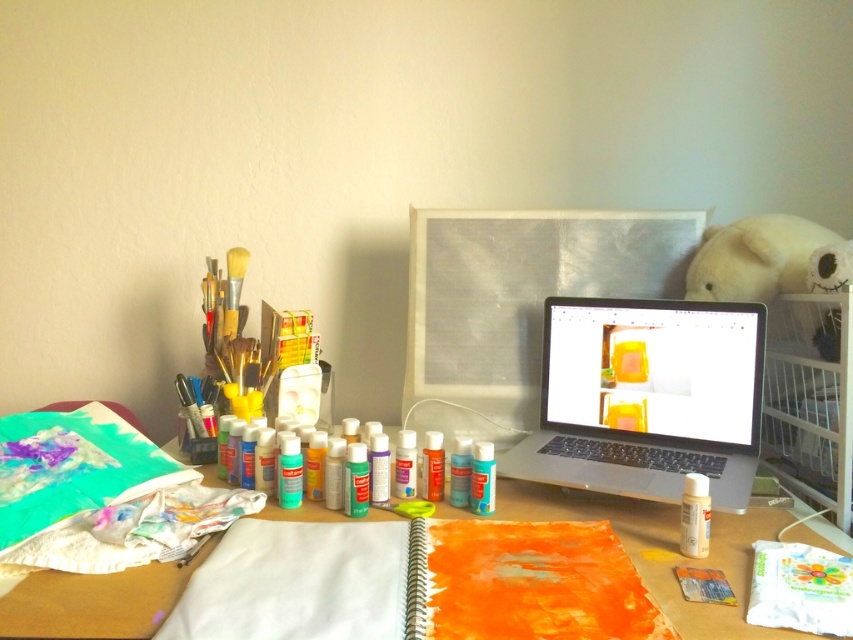
From the picture: You are an artist who needs to reach the silver metallic laptop at center to check a reference image. You are currently standing 40 inches away from the desk. Can you comfortably reach the laptop without moving closer?

The silver metallic laptop at center is 38.10 inches away from the viewer. Since you are 40 inches away from the desk, you are slightly further than the laptop, so you might need to move closer to comfortably reach it.

You are an artist who needs to place a 20 cm wide ruler between the silver metallic laptop at center and the matte orange paper at center on the desk. Is there enough space for the ruler to fit between them?

The silver metallic laptop at center and the matte orange paper at center are 18.19 centimeters apart. Since the ruler is 20 cm wide, it cannot fit between them as the distance is shorter than the ruler.

You are an artist working at the desk and want to place a new canvas between the metallic silver monitor at center and the matte orange paper at center. Which object should you move to make space?

You should move the metallic silver monitor at center because it is closer to you than the matte orange paper at center, so moving it would create space between them.